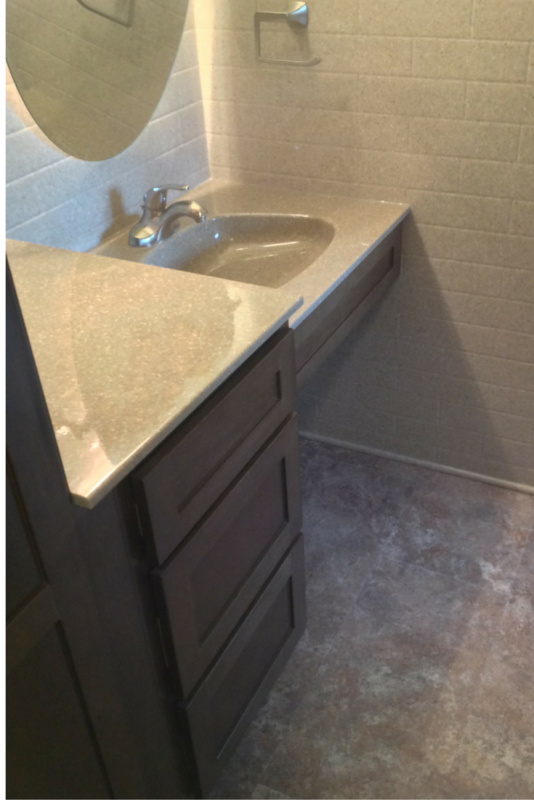
Locate an element on the screen. The height and width of the screenshot is (800, 534). sink is located at coordinates (256, 268).